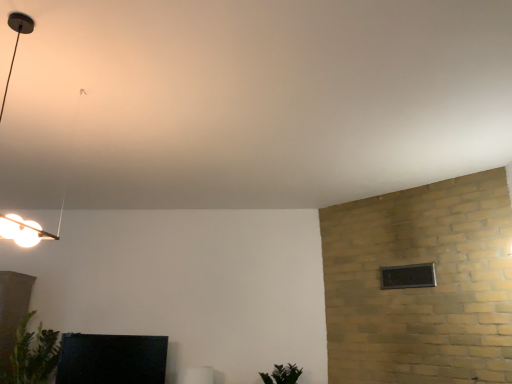
Question: Would you say green leafy plant at lower left, acting as the first plant starting from the left, is inside or outside black glass window at upper right?

Choices:
 (A) inside
 (B) outside

Answer: (B)

Question: Is point (41, 362) closer or farther from the camera than point (416, 271)?

Choices:
 (A) farther
 (B) closer

Answer: (A)

Question: Which object is positioned closest to the matte black lamp at upper left?

Choices:
 (A) green leafy plant at lower left, acting as the first plant starting from the left
 (B) green matte plant at lower center, which ranks as the second plant in left-to-right order
 (C) matte black tv at lower left, the 2th furniture from the right
 (D) black glass window at upper right
 (E) white glossy frame at lower center, the 2th furniture in the left-to-right sequence

Answer: (A)

Question: Estimate the real-world distances between objects in this image. Which object is farther from the green leafy plant at lower left, positioned as the 2th plant in right-to-left order?

Choices:
 (A) black glass window at upper right
 (B) white glossy frame at lower center, the 2th furniture in the left-to-right sequence
 (C) matte black tv at lower left, which is counted as the 1th furniture, starting from the left
 (D) green matte plant at lower center, which ranks as the second plant in left-to-right order
 (E) matte black lamp at upper left

Answer: (A)